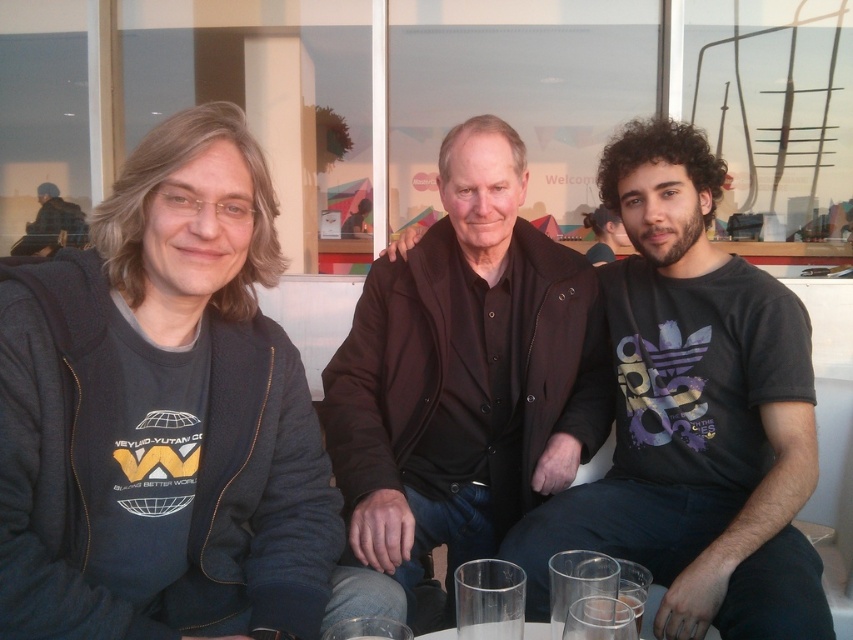
Question: Is dark gray hoodie at left smaller than transparent glass at lower center?

Choices:
 (A) no
 (B) yes

Answer: (A)

Question: From the image, what is the correct spatial relationship of dark gray hoodie at left in relation to transparent glass at lower center?

Choices:
 (A) left
 (B) right

Answer: (A)

Question: Which point is farther to the camera?

Choices:
 (A) (457, 625)
 (B) (583, 621)
 (C) (30, 234)
 (D) (375, 280)

Answer: (C)

Question: Which point is farther to the camera?

Choices:
 (A) dark gray hoodie at left
 (B) dark blue uniform at left
 (C) clear glass at lower center
 (D) dark brown leather jacket at center

Answer: (B)

Question: Does dark gray hoodie at left appear on the left side of dark blue uniform at left?

Choices:
 (A) no
 (B) yes

Answer: (A)

Question: Which point is closer to the camera?

Choices:
 (A) (53, 193)
 (B) (675, 636)
 (C) (397, 540)
 (D) (520, 636)

Answer: (D)